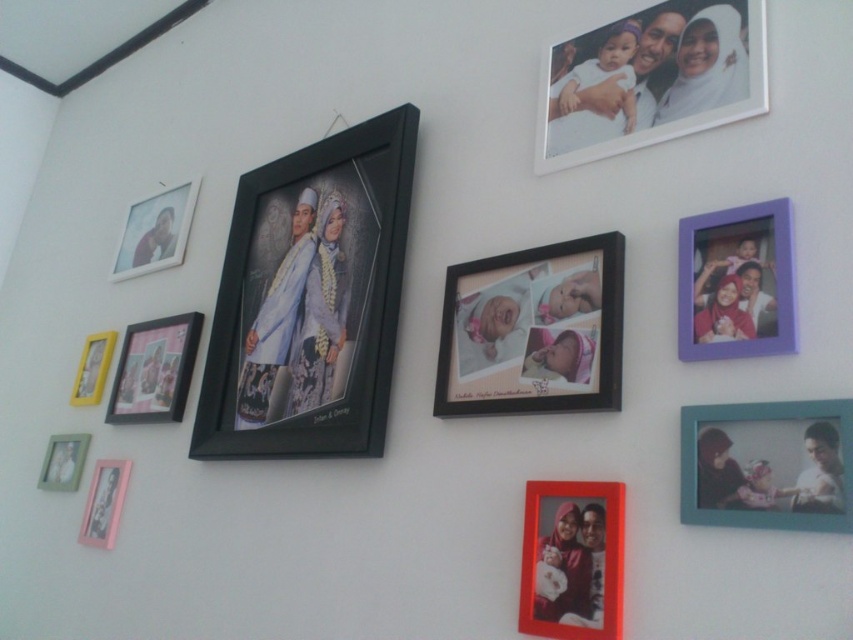
Question: From the image, what is the correct spatial relationship of white matte photo frame at upper right in relation to pink matte picture frame at left?

Choices:
 (A) left
 (B) right

Answer: (B)

Question: Which object appears farthest from the camera in this image?

Choices:
 (A) matte plastic photo frame at center
 (B) purple plastic picture frame at upper right

Answer: (A)

Question: Is matte plastic photo frame at center wider than pink matte picture frame at left?

Choices:
 (A) no
 (B) yes

Answer: (A)

Question: Does white matte photo frame at upper right appear under matte pink photo frame at lower left?

Choices:
 (A) yes
 (B) no

Answer: (B)

Question: Considering the real-world distances, which object is farthest from the black matte picture frame at center?

Choices:
 (A) teal plastic photo frame at lower right
 (B) matte black frame at upper left

Answer: (A)

Question: Which object is farther from the camera taking this photo?

Choices:
 (A) black matte photo frame at center
 (B) purple plastic picture frame at upper right
 (C) white matte photo frame at upper right
 (D) matte plastic photo frame at center

Answer: (C)